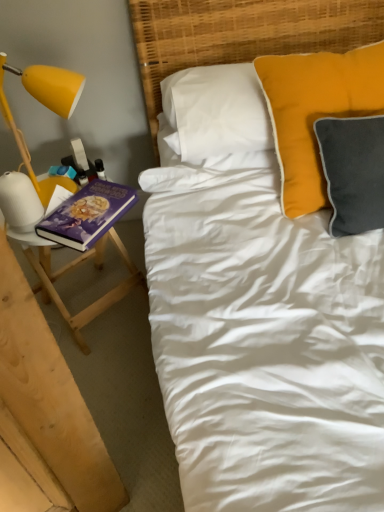
Question: Can you confirm if yellow matte lamp at left is shorter than purple matte book at left?

Choices:
 (A) no
 (B) yes

Answer: (A)

Question: Are yellow matte lamp at left and purple matte book at left located far from each other?

Choices:
 (A) no
 (B) yes

Answer: (A)

Question: Is yellow matte lamp at left oriented away from purple matte book at left?

Choices:
 (A) no
 (B) yes

Answer: (A)

Question: Is yellow matte lamp at left completely or partially outside of purple matte book at left?

Choices:
 (A) yes
 (B) no

Answer: (A)

Question: From a real-world perspective, is yellow matte lamp at left on purple matte book at left?

Choices:
 (A) yes
 (B) no

Answer: (A)

Question: Considering the relative sizes of yellow matte lamp at left and purple matte book at left in the image provided, is yellow matte lamp at left taller than purple matte book at left?

Choices:
 (A) no
 (B) yes

Answer: (B)

Question: Does wooden stool at left have a greater width compared to yellow matte lamp at left?

Choices:
 (A) yes
 (B) no

Answer: (A)

Question: Is the depth of wooden stool at left less than that of yellow matte lamp at left?

Choices:
 (A) no
 (B) yes

Answer: (A)

Question: Does wooden stool at left have a larger size compared to yellow matte lamp at left?

Choices:
 (A) no
 (B) yes

Answer: (B)

Question: Is wooden stool at left aimed at yellow matte lamp at left?

Choices:
 (A) no
 (B) yes

Answer: (A)

Question: From the image's perspective, would you say wooden stool at left is shown under yellow matte lamp at left?

Choices:
 (A) no
 (B) yes

Answer: (B)

Question: Is wooden stool at left positioned with its back to yellow matte lamp at left?

Choices:
 (A) no
 (B) yes

Answer: (A)

Question: Does purple matte book at left turn towards woven bamboo headboard at upper center?

Choices:
 (A) no
 (B) yes

Answer: (A)